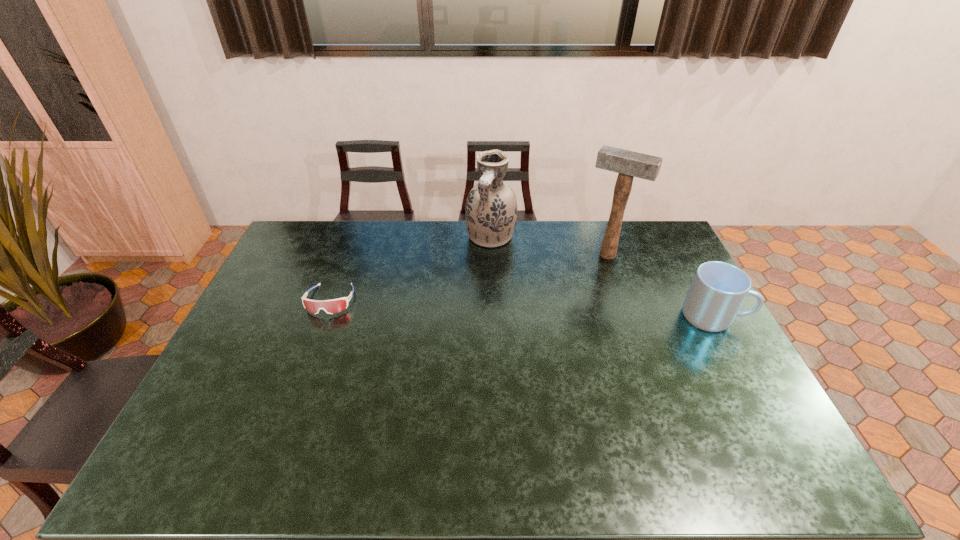
At what (x,y) coordinates should I click in order to perform the action: click on vacant space at the left edge of the desktop. Please return your answer as a coordinate pair (x, y). The width and height of the screenshot is (960, 540). Looking at the image, I should click on (309, 280).

This screenshot has height=540, width=960. Find the location of `free space at the right edge of the desktop`. free space at the right edge of the desktop is located at coordinates (683, 300).

Locate an element on the screen. The height and width of the screenshot is (540, 960). blank space at the far left corner of the desktop is located at coordinates (324, 237).

I want to click on vacant space in between the mug and the mallet, so click(660, 285).

I want to click on free point between the second shortest object and the shortest object, so click(521, 308).

The width and height of the screenshot is (960, 540). In order to click on free space between the rightmost object and the third object from left to right in this screenshot , I will do `click(660, 285)`.

Locate an element on the screen. blank region between the third object from left to right and the goggles is located at coordinates (468, 277).

Locate an element on the screen. vacant space in between the second tallest object and the leftmost object is located at coordinates (411, 269).

The image size is (960, 540). I want to click on vacant space in between the third shortest object and the third object from left to right, so click(549, 246).

Find the location of a particular element. This screenshot has height=540, width=960. vacant area that lies between the leftmost object and the second object from left to right is located at coordinates point(411,269).